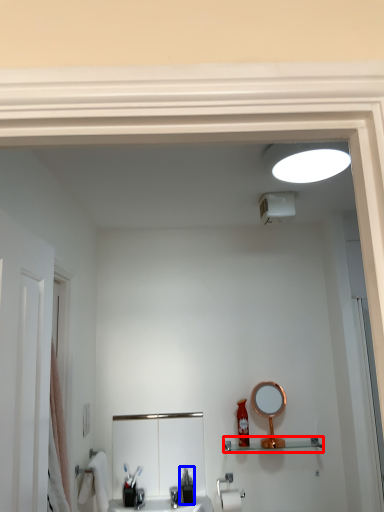
Question: Among these objects, which one is farthest to the camera, shelve (highlighted by a red box) or soap dispenser (highlighted by a blue box)?

Choices:
 (A) shelve
 (B) soap dispenser

Answer: (A)